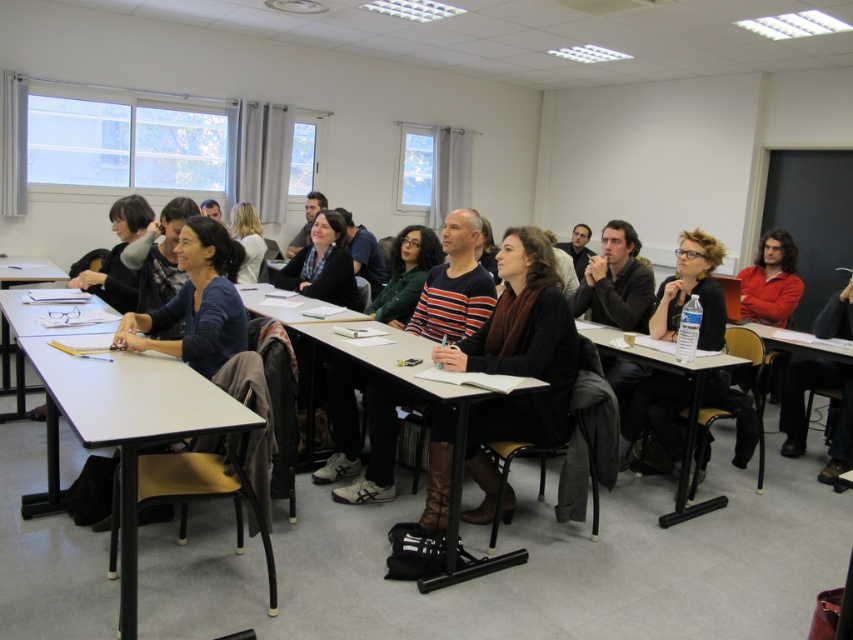
How far apart are white plastic table at center and smooth wooden table at center?

The distance of white plastic table at center from smooth wooden table at center is 90.94 centimeters.

The height and width of the screenshot is (640, 853). What do you see at coordinates (119, 420) in the screenshot?
I see `white plastic table at center` at bounding box center [119, 420].

The width and height of the screenshot is (853, 640). Describe the element at coordinates (119, 420) in the screenshot. I see `white plastic table at center` at that location.

Find the location of `white plastic table at center`. white plastic table at center is located at coordinates (119, 420).

Does white plastic table at center have a larger size compared to wooden table at lower right?

Indeed, white plastic table at center has a larger size compared to wooden table at lower right.

Is white plastic table at center thinner than wooden table at lower right?

No.

Is point (67, 376) positioned before point (843, 385)?

Yes.

At what (x,y) coordinates should I click in order to perform the action: click on white plastic table at center. Please return your answer as a coordinate pair (x, y). The height and width of the screenshot is (640, 853). Looking at the image, I should click on (119, 420).

Who is higher up, white plastic table at center or brown leather boots at center?

brown leather boots at center is above.

You are a GUI agent. You are given a task and a screenshot of the screen. Output one action in this format:
    pyautogui.click(x=<x>, y=<y>)
    Task: Click on the white plastic table at center
    The height and width of the screenshot is (640, 853).
    Given the screenshot: What is the action you would take?
    pyautogui.click(x=119, y=420)

Who is more forward, [219,392] or [436,435]?

Point [219,392]

Where is `white plastic table at center`? The image size is (853, 640). white plastic table at center is located at coordinates (119, 420).